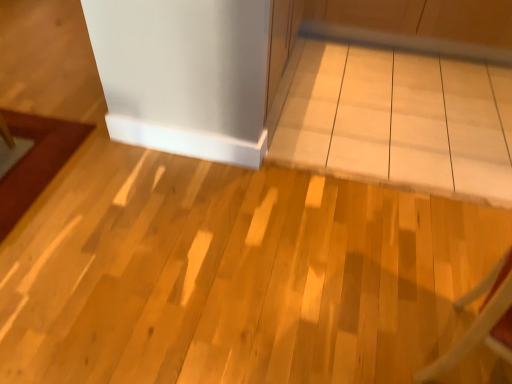
Question: Is point (496, 349) positioned closer to the camera than point (475, 139)?

Choices:
 (A) farther
 (B) closer

Answer: (B)

Question: From a real-world perspective, is wooden chair at lower right physically located above or below white glossy table at center?

Choices:
 (A) below
 (B) above

Answer: (B)

Question: In the image, is wooden chair at lower right on the left side or the right side of white glossy table at center?

Choices:
 (A) left
 (B) right

Answer: (B)

Question: Is white glossy table at center in front of or behind wooden chair at lower right in the image?

Choices:
 (A) behind
 (B) front

Answer: (A)

Question: Considering the positions of white glossy table at center and wooden chair at lower right in the image, is white glossy table at center taller or shorter than wooden chair at lower right?

Choices:
 (A) tall
 (B) short

Answer: (B)

Question: Considering the positions of white glossy table at center and wooden chair at lower right in the image, is white glossy table at center wider or thinner than wooden chair at lower right?

Choices:
 (A) thin
 (B) wide

Answer: (B)

Question: From a real-world perspective, is white glossy table at center physically located above or below wooden chair at lower right?

Choices:
 (A) below
 (B) above

Answer: (A)